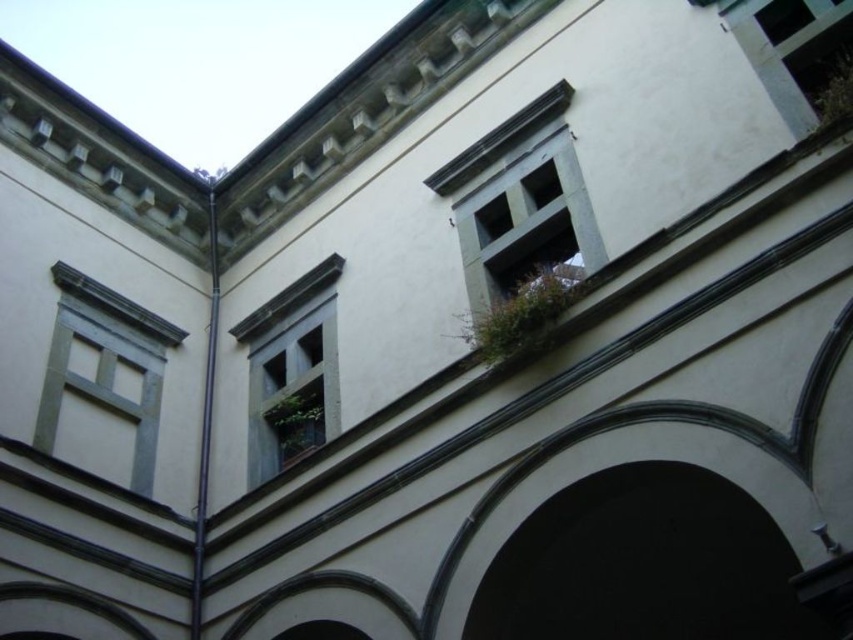
Which of these two, gray stone window at upper center or matte gray window at upper left, stands taller?

Standing taller between the two is gray stone window at upper center.

What do you see at coordinates (520, 216) in the screenshot? This screenshot has width=853, height=640. I see `gray stone window at upper center` at bounding box center [520, 216].

This screenshot has height=640, width=853. What do you see at coordinates (520, 216) in the screenshot?
I see `gray stone window at upper center` at bounding box center [520, 216].

In order to click on gray stone window at upper center in this screenshot , I will do `click(520, 216)`.

How far apart are gray stone window at upper center and blue painted wood window at center?

53.83 feet

In order to click on gray stone window at upper center in this screenshot , I will do `click(520, 216)`.

Who is more forward, (502, 260) or (332, 332)?

Point (502, 260)

At what (x,y) coordinates should I click in order to perform the action: click on gray stone window at upper center. Please return your answer as a coordinate pair (x, y). The height and width of the screenshot is (640, 853). Looking at the image, I should click on (520, 216).

Is matte gray window at upper left below blue painted wood window at center?

Actually, matte gray window at upper left is above blue painted wood window at center.

Consider the image. Does matte gray window at upper left have a greater width compared to blue painted wood window at center?

In fact, matte gray window at upper left might be narrower than blue painted wood window at center.

Who is more distant from viewer, (131, 310) or (267, 440)?

The point (131, 310) is more distant.

Find the location of `matte gray window at upper left`. matte gray window at upper left is located at coordinates (103, 380).